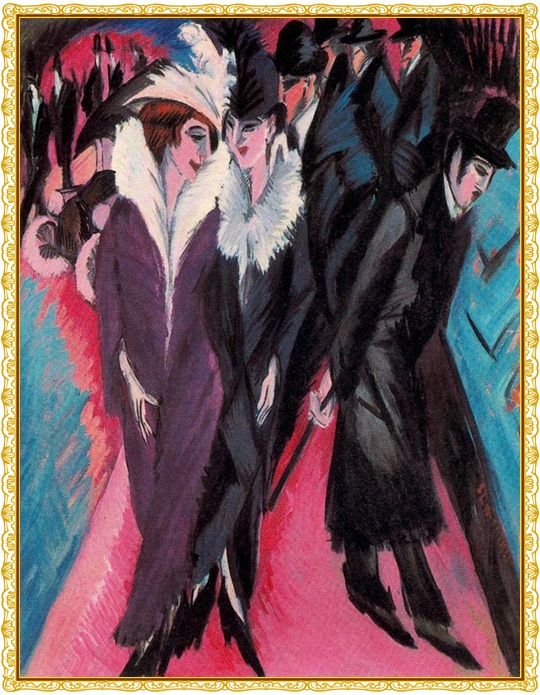
At what (x,y) coordinates should I click in order to perform the action: click on red carpet. Please return your answer as a coordinate pair (x, y). Image resolution: width=540 pixels, height=695 pixels. Looking at the image, I should click on (297, 593).